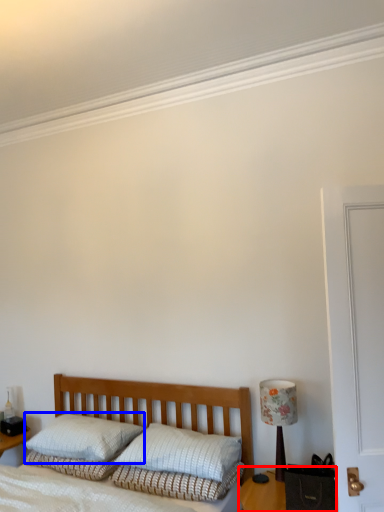
Question: Which object appears closest to the camera in this image, table (highlighted by a red box) or pillow (highlighted by a blue box)?

Choices:
 (A) table
 (B) pillow

Answer: (A)